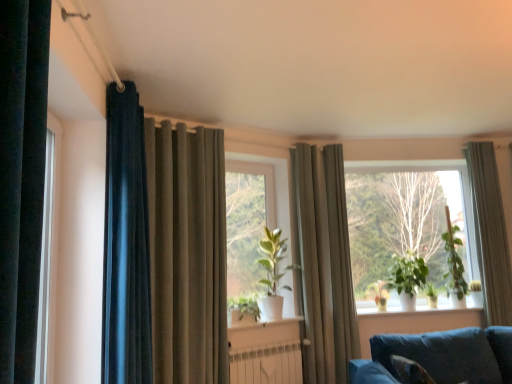
Question: Is green matte plant at right, the second plant viewed from the right, in front of green matte plant at center?

Choices:
 (A) no
 (B) yes

Answer: (A)

Question: From a real-world perspective, is green matte plant at right, the second plant viewed from the right, physically below green matte plant at center?

Choices:
 (A) no
 (B) yes

Answer: (B)

Question: Is green matte plant at right, the second plant viewed from the right, taller than green matte plant at center?

Choices:
 (A) yes
 (B) no

Answer: (B)

Question: Could you tell me if green matte plant at right, the second plant viewed from the right, is facing green matte plant at center?

Choices:
 (A) no
 (B) yes

Answer: (A)

Question: Is green matte plant at right, the second plant viewed from the right, at the right side of green matte plant at center?

Choices:
 (A) no
 (B) yes

Answer: (B)

Question: Considering the positions of green matte plant at right, which ranks as the 4th plant in left-to-right order, and velvet blue couch at lower right in the image, is green matte plant at right, which ranks as the 4th plant in left-to-right order, wider or thinner than velvet blue couch at lower right?

Choices:
 (A) thin
 (B) wide

Answer: (A)

Question: Considering the positions of point (428, 283) and point (425, 369), is point (428, 283) closer or farther from the camera than point (425, 369)?

Choices:
 (A) farther
 (B) closer

Answer: (A)

Question: Is green matte plant at right, which ranks as the 4th plant in left-to-right order, bigger or smaller than velvet blue couch at lower right?

Choices:
 (A) small
 (B) big

Answer: (A)

Question: Relative to velvet blue couch at lower right, is green matte plant at right, which ranks as the 4th plant in left-to-right order, in front or behind?

Choices:
 (A) behind
 (B) front

Answer: (A)

Question: In terms of width, does green matte plant at center look wider or thinner when compared to velvet blue couch at lower right?

Choices:
 (A) thin
 (B) wide

Answer: (A)

Question: Considering the relative positions of green matte plant at center and velvet blue couch at lower right in the image provided, is green matte plant at center to the left or to the right of velvet blue couch at lower right?

Choices:
 (A) right
 (B) left

Answer: (B)

Question: Considering the positions of green matte plant at center and velvet blue couch at lower right in the image, is green matte plant at center taller or shorter than velvet blue couch at lower right?

Choices:
 (A) tall
 (B) short

Answer: (A)

Question: Is green matte plant at center inside or outside of velvet blue couch at lower right?

Choices:
 (A) inside
 (B) outside

Answer: (B)

Question: From the image's perspective, is white matte window sill at center positioned above or below matte gray curtain at center, the third curtain from the left?

Choices:
 (A) below
 (B) above

Answer: (A)

Question: Is white matte window sill at center bigger or smaller than matte gray curtain at center, the second curtain positioned from the right?

Choices:
 (A) small
 (B) big

Answer: (A)